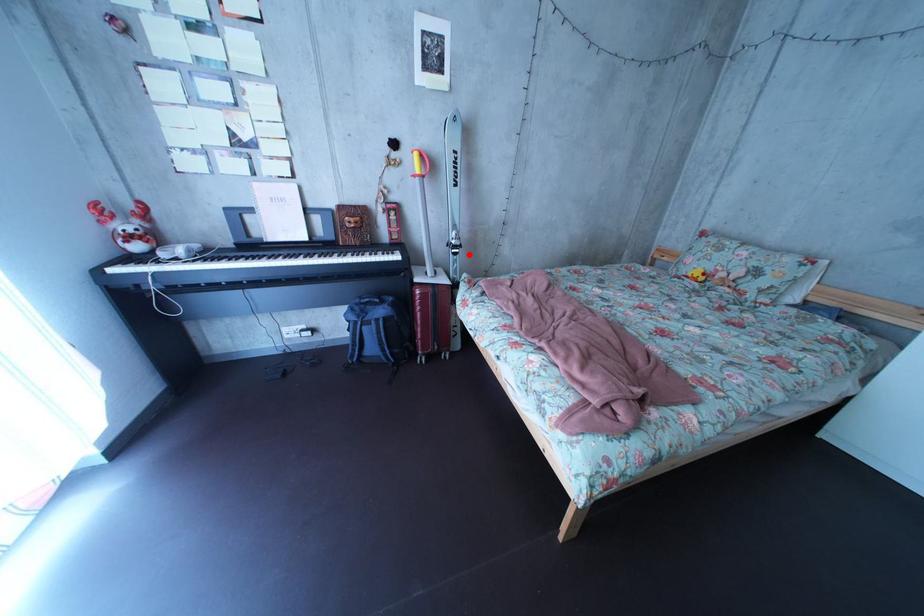
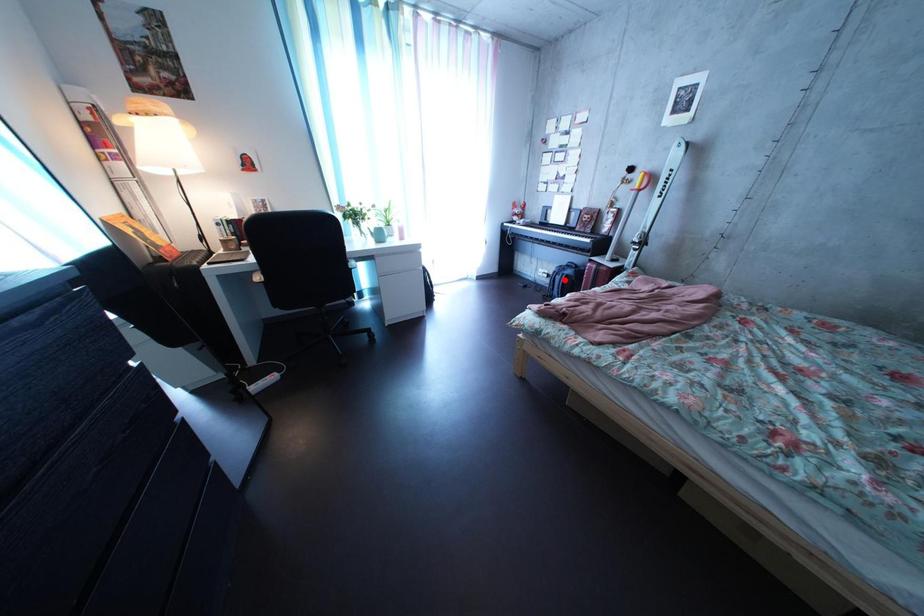
I am providing you with two images of the same scene from different viewpoints. A red point is marked on the first image and another point is marked on the second image. Is the red point in image1 aligned with the point shown in image2?

No